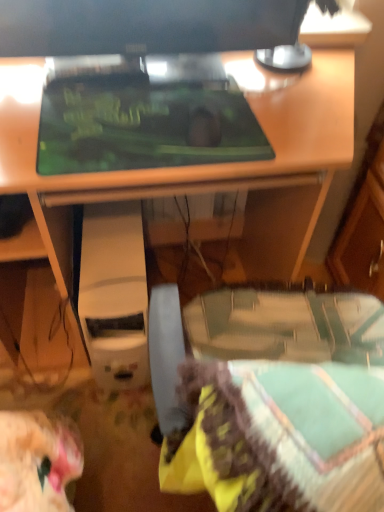
Question: Based on their sizes in the image, would you say matte black desk at center is bigger or smaller than green matte mousepad at center?

Choices:
 (A) small
 (B) big

Answer: (B)

Question: Is matte black desk at center spatially inside green matte mousepad at center, or outside of it?

Choices:
 (A) inside
 (B) outside

Answer: (B)

Question: Which is farther from the green matte mousepad at center?

Choices:
 (A) matte black desk at center
 (B) matte black monitor at upper center
 (C) white plastic computer at center

Answer: (C)

Question: Which object is the closest to the green matte mousepad at center?

Choices:
 (A) matte black desk at center
 (B) matte black monitor at upper center
 (C) white plastic computer at center

Answer: (B)